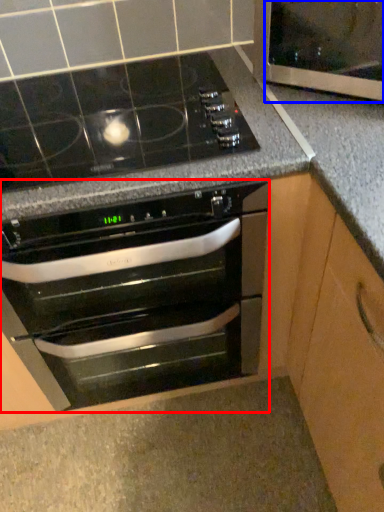
Question: Which object is further to the camera taking this photo, oven (highlighted by a red box) or glass door (highlighted by a blue box)?

Choices:
 (A) oven
 (B) glass door

Answer: (B)